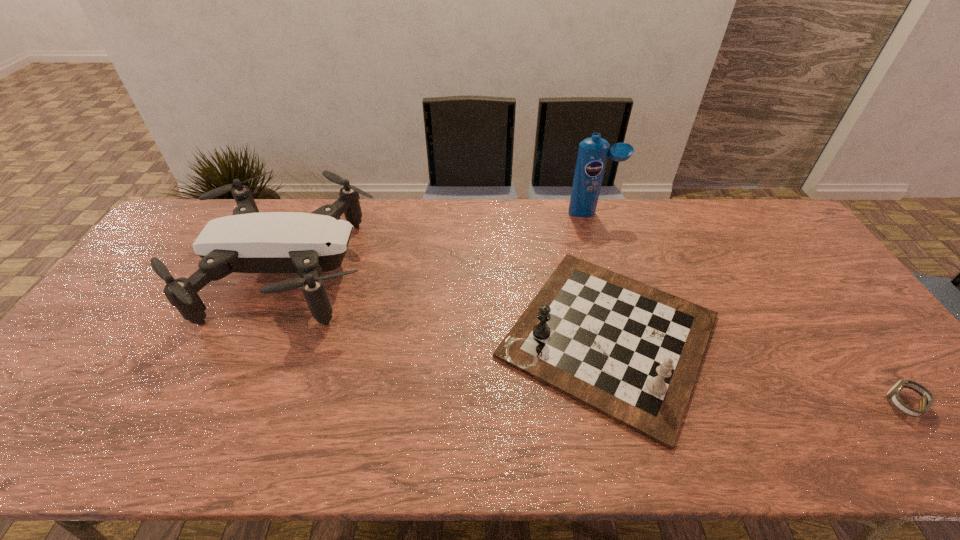
In order to click on free region located on the face of the rightmost object in this screenshot , I will do `click(732, 404)`.

The width and height of the screenshot is (960, 540). Identify the location of vacant area located 0.390m on the face of the rightmost object. (720, 404).

Find the location of a particular element. The height and width of the screenshot is (540, 960). shampoo at the far edge is located at coordinates (592, 156).

Where is `drone present at the far edge`? drone present at the far edge is located at coordinates (248, 241).

Where is `object at the near edge`? object at the near edge is located at coordinates (631, 352).

Where is `object at the right edge`? This screenshot has width=960, height=540. object at the right edge is located at coordinates (927, 400).

This screenshot has height=540, width=960. I want to click on free region at the far edge, so click(x=711, y=240).

This screenshot has height=540, width=960. I want to click on vacant space at the near edge, so click(x=325, y=424).

At what (x,y) coordinates should I click in order to perform the action: click on vacant space at the left edge. Please return your answer as a coordinate pair (x, y). The image size is (960, 540). Looking at the image, I should click on (173, 259).

Image resolution: width=960 pixels, height=540 pixels. Find the location of `vacant region at the right edge of the desktop`. vacant region at the right edge of the desktop is located at coordinates (883, 404).